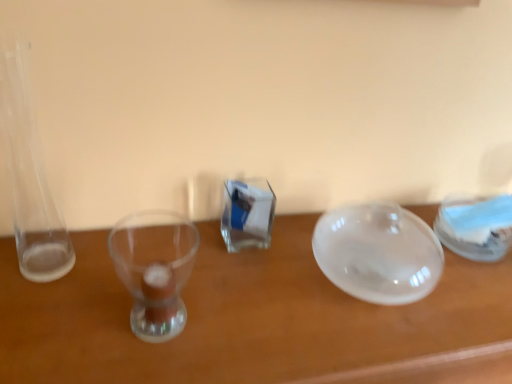
Question: Considering the relative positions of transparent glass bowl at center and transparent plastic container at right in the image provided, is transparent glass bowl at center to the left or to the right of transparent plastic container at right?

Choices:
 (A) left
 (B) right

Answer: (A)

Question: Is transparent glass bowl at center in front of or behind transparent plastic container at right in the image?

Choices:
 (A) front
 (B) behind

Answer: (A)

Question: From the image's perspective, is transparent glass bowl at center located above or below transparent plastic container at right?

Choices:
 (A) above
 (B) below

Answer: (B)

Question: Considering the positions of point (446, 203) and point (126, 329), is point (446, 203) closer or farther from the camera than point (126, 329)?

Choices:
 (A) closer
 (B) farther

Answer: (B)

Question: Is transparent plastic container at right situated inside transparent glass bowl at center or outside?

Choices:
 (A) inside
 (B) outside

Answer: (B)

Question: Is transparent plastic container at right to the left or to the right of transparent glass bowl at center in the image?

Choices:
 (A) right
 (B) left

Answer: (A)

Question: Is transparent plastic container at right in front of or behind transparent glass bowl at center in the image?

Choices:
 (A) front
 (B) behind

Answer: (B)